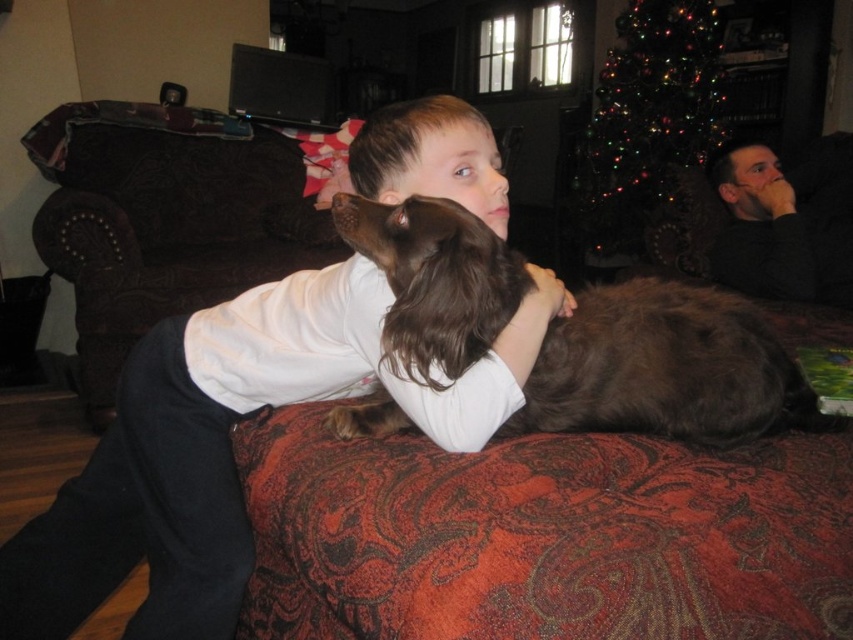
You are standing in the living room and see two points marked in the image. The first point is at coordinates point (582, 394) and the second point is at point (100, 394). Which point is closer to you?

Point (582, 394) is in front of point (100, 394), so it is closer to you.

You are a photographer trying to capture a closeup of the brown furry dog at center without including the white soft shirt at center in the frame. Given their positions, is this possible?

The white soft shirt at center is to the left of brown furry dog at center, so if you position your camera to the right side of the dog, you can capture the dog without the shirt in the frame.

You are a photographer taking a picture of the scene. You notice the white soft shirt at center and the brown fur at center. Which object should appear larger in the photo if you focus on the closer one?

The white soft shirt at center is closer to the viewer than the brown fur at center, so it will appear larger in the photo when focusing on the closer object.